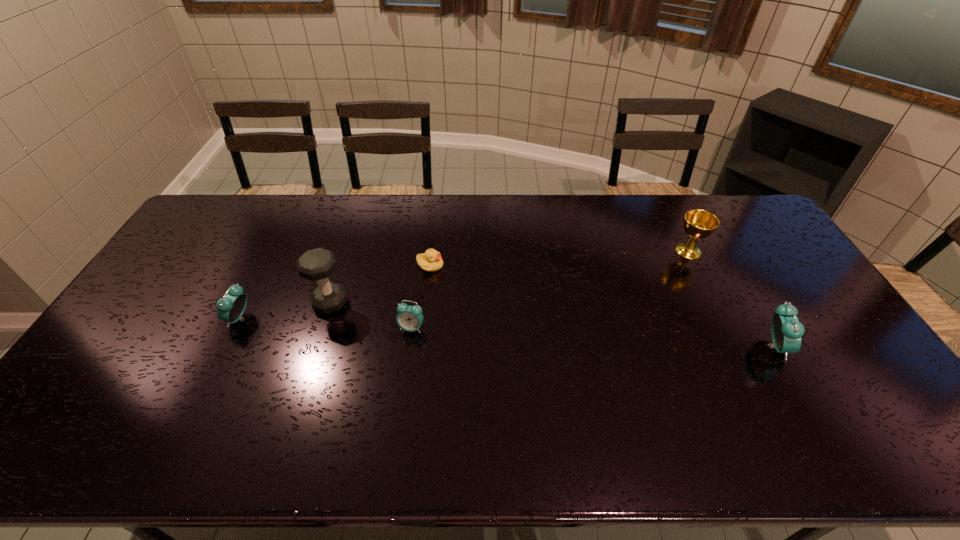
If we want them evenly spaced by inserting an extra alarm_clock among them, please locate a free spot for this new alarm_clock. Please provide its 2D coordinates. Your answer should be formatted as a tuple, i.e. [(x, y)], where the tuple contains the x and y coordinates of a point satisfying the conditions above.

[(589, 337)]